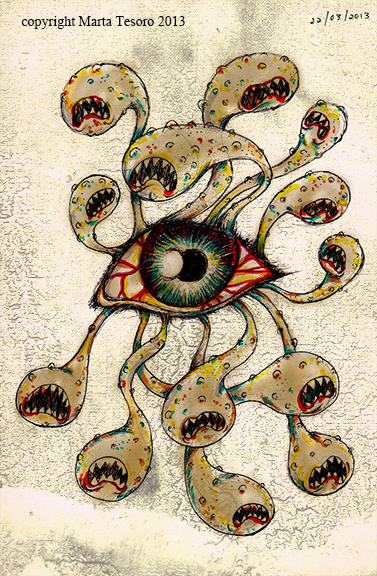
Identify the location of art piece. Image resolution: width=377 pixels, height=576 pixels. (171, 502).